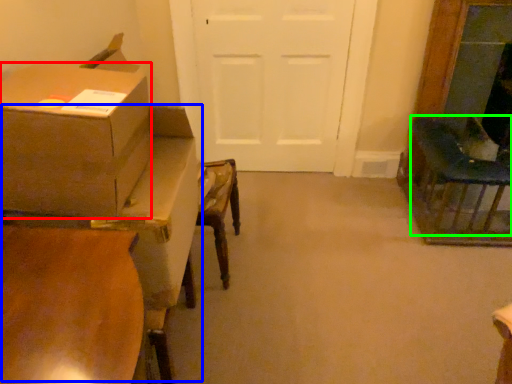
Question: Which object is positioned closest to box (highlighted by a red box)? Select from table (highlighted by a blue box) and chair (highlighted by a green box).

Choices:
 (A) table
 (B) chair

Answer: (A)